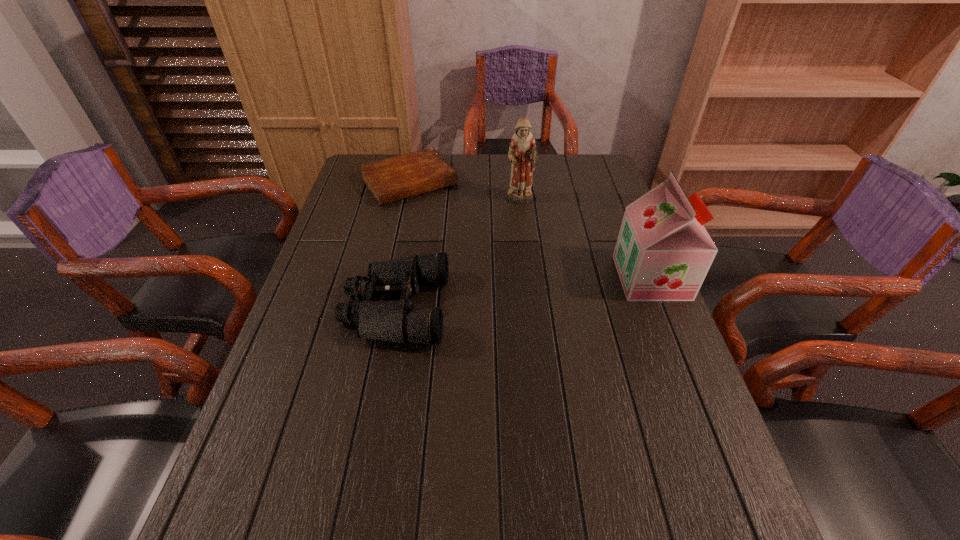
Where is `free space between the rightmost object and the second object from right to left`? free space between the rightmost object and the second object from right to left is located at coordinates (586, 239).

Identify the location of vacant region between the shortest object and the second shortest object. Image resolution: width=960 pixels, height=540 pixels. (402, 245).

This screenshot has width=960, height=540. In order to click on free point between the rightmost object and the binoculars in this screenshot , I will do `click(523, 293)`.

I want to click on free space between the binoculars and the second object from right to left, so click(457, 254).

Locate an element on the screen. free space between the third tallest object and the rightmost object is located at coordinates (523, 293).

The height and width of the screenshot is (540, 960). Identify the location of vacant area that lies between the figurine and the rightmost object. (586, 239).

Identify the location of vacant space in between the figurine and the rightmost object. This screenshot has width=960, height=540. (586, 239).

The height and width of the screenshot is (540, 960). I want to click on vacant area that lies between the binoculars and the third object from left to right, so click(457, 254).

Identify the location of blank region between the shortest object and the third object from left to right. The height and width of the screenshot is (540, 960). (465, 191).

Locate an element on the screen. This screenshot has width=960, height=540. vacant space that is in between the soya milk and the shortest object is located at coordinates (530, 230).